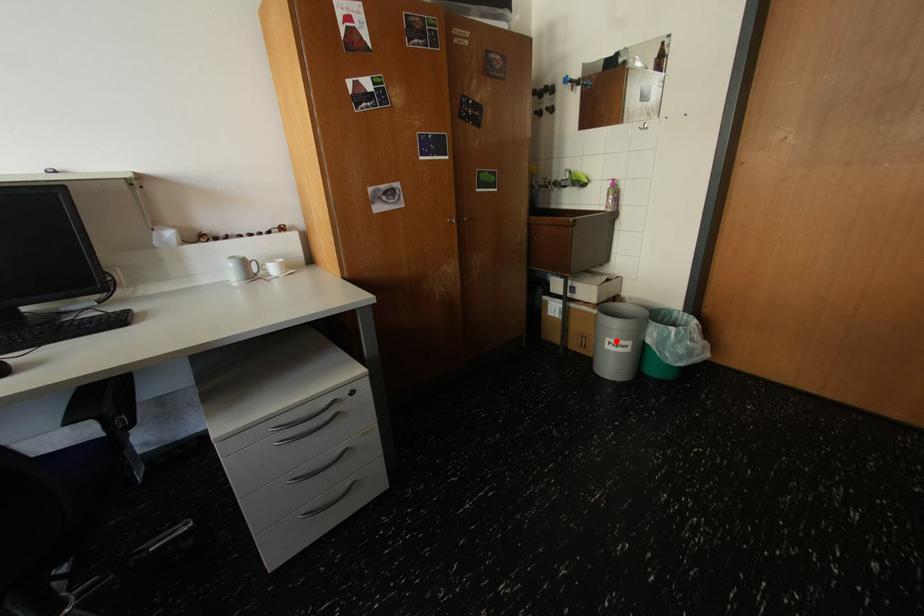
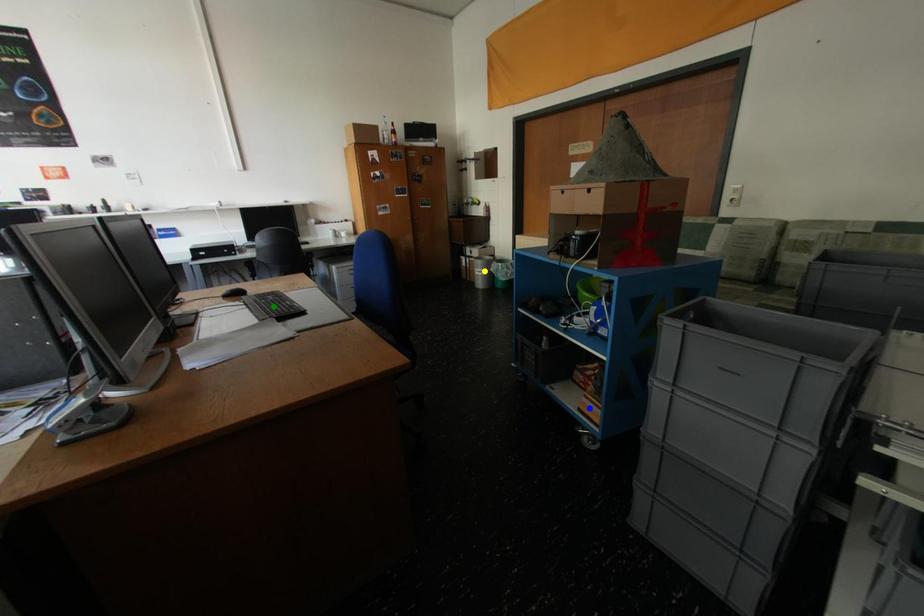
Question: I am providing you with two images of the same scene from different viewpoints. A red point is marked on the first image. You are given multiple points on the second image. Can you choose the point in image 2 that corresponds to the point in image 1?

Choices:
 (A) blue point
 (B) yellow point
 (C) green point

Answer: (B)